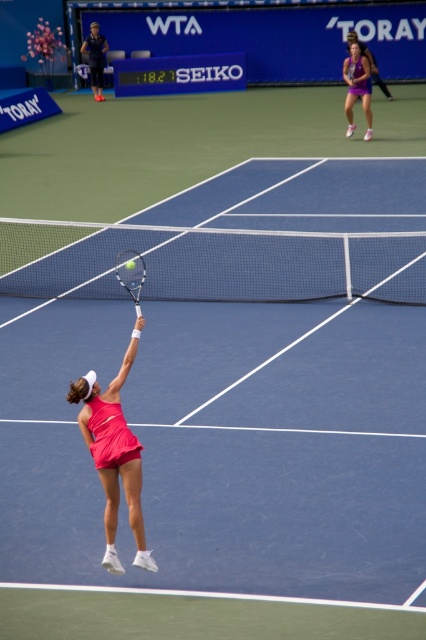
Who is positioned more to the right, purple fabric tennis outfit at upper right or silver metallic tennis racket at center?

purple fabric tennis outfit at upper right is more to the right.

Does point (368, 132) come in front of point (126, 260)?

No, (368, 132) is behind (126, 260).

The image size is (426, 640). I want to click on purple fabric tennis outfit at upper right, so click(x=357, y=88).

Between point (115, 490) and point (132, 296), which one is positioned in front?

Positioned in front is point (115, 490).

Which is below, pink fabric tennis outfit at center or silver metallic tennis racket at center?

Positioned lower is pink fabric tennis outfit at center.

Is point (124, 458) farther from camera compared to point (124, 276)?

No, (124, 458) is closer to viewer.

Identify the location of pink fabric tennis outfit at center. (114, 452).

Find the location of `pink fabric tennis outfit at center`. pink fabric tennis outfit at center is located at coordinates (114, 452).

Who is positioned more to the left, pink fabric tennis outfit at center or purple fabric tennis outfit at upper right?

pink fabric tennis outfit at center

Find the location of a particular element. Image resolution: width=426 pixels, height=640 pixels. pink fabric tennis outfit at center is located at coordinates (114, 452).